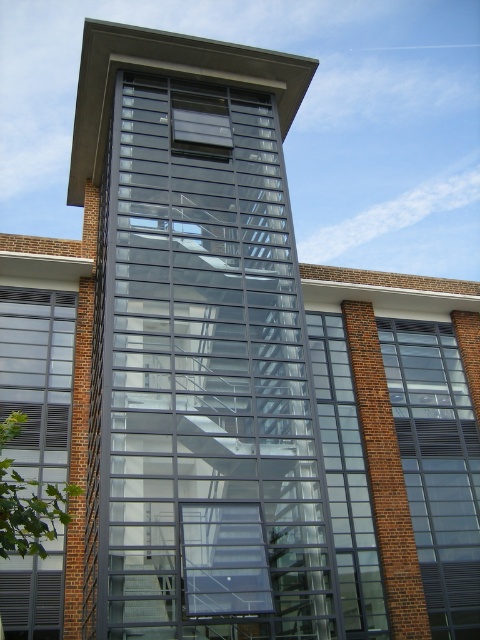
You are standing in front of the building and notice two glass windows, the transparent glass window at right and the clear glass window at left. Which one is located lower in the building?

The transparent glass window at right is positioned under the clear glass window at left, so it is located lower in the building.